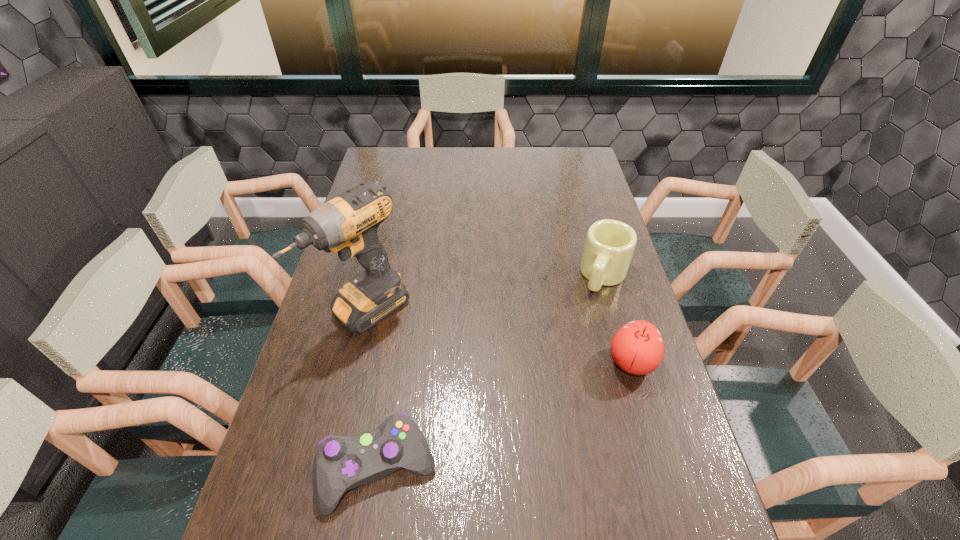
The height and width of the screenshot is (540, 960). Find the location of `control`. control is located at coordinates (341, 463).

Find the location of a particular element. This screenshot has height=540, width=960. the shortest object is located at coordinates (341, 463).

Find the location of `apple`. apple is located at coordinates (637, 348).

The height and width of the screenshot is (540, 960). I want to click on drill, so click(x=348, y=224).

In order to click on mug in this screenshot , I will do `click(609, 246)`.

The height and width of the screenshot is (540, 960). What are the coordinates of `free space located on the right of the control` in the screenshot? It's located at (588, 469).

This screenshot has width=960, height=540. In order to click on vacant space located on the back of the apple in this screenshot , I will do `click(605, 268)`.

Identify the location of vacant position located 0.090m with the drill bit of the drill facing forward. Image resolution: width=960 pixels, height=540 pixels. (415, 354).

Identify the location of vacant region located 0.120m with the drill bit of the drill facing forward. The width and height of the screenshot is (960, 540). (422, 360).

Where is `vacant space located with the drill bit of the drill facing forward`? vacant space located with the drill bit of the drill facing forward is located at coordinates (463, 395).